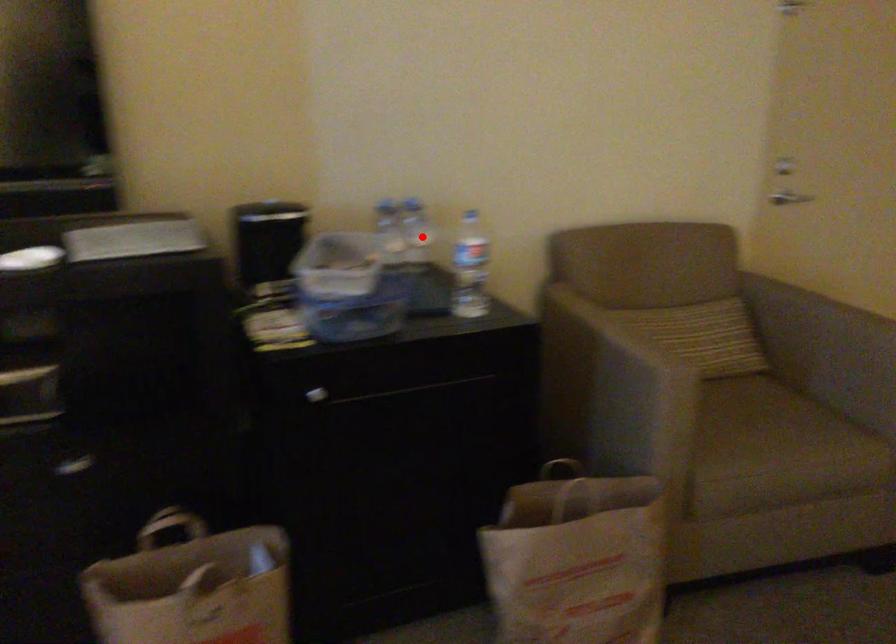
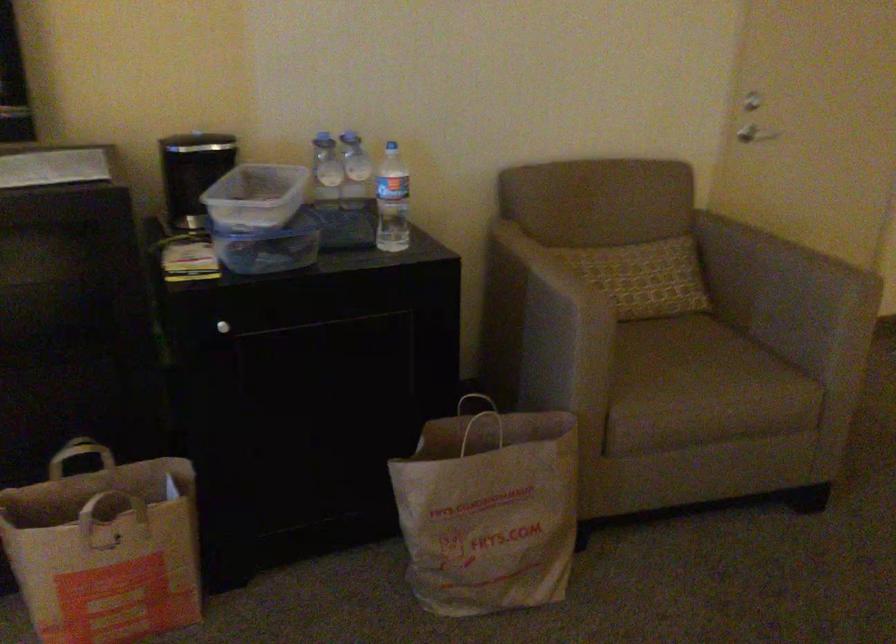
Locate, in the second image, the point that corresponds to the highlighted location in the first image.

(355, 171)